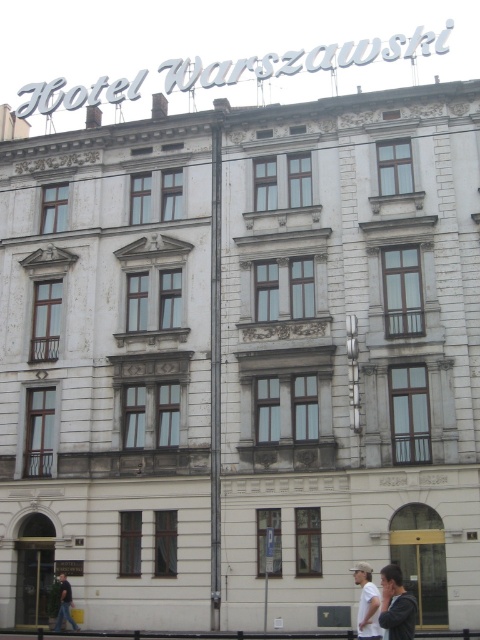
Who is shorter, dark gray hoodie at center or white cotton shirt at lower right?

With less height is dark gray hoodie at center.

Which is more to the left, dark gray hoodie at center or white cotton shirt at lower right?

white cotton shirt at lower right is more to the left.

Is point (388, 632) positioned after point (369, 564)?

No, it is in front of (369, 564).

At what (x,y) coordinates should I click in order to perform the action: click on dark gray hoodie at center. Please return your answer as a coordinate pair (x, y). The height and width of the screenshot is (640, 480). Looking at the image, I should click on (396, 604).

Consider the image. Does dark gray hoodie at center appear on the left side of dark gray cotton shirt at lower left?

Incorrect, dark gray hoodie at center is not on the left side of dark gray cotton shirt at lower left.

Can you confirm if dark gray hoodie at center is thinner than dark gray cotton shirt at lower left?

Incorrect, dark gray hoodie at center's width is not less than dark gray cotton shirt at lower left's.

What are the coordinates of `dark gray hoodie at center` in the screenshot? It's located at (396, 604).

Which is more to the right, white cotton shirt at lower right or dark gray cotton shirt at lower left?

Positioned to the right is white cotton shirt at lower right.

Who is more forward, (363,621) or (60,588)?

Point (363,621) is more forward.

Locate an element on the screen. The image size is (480, 640). white cotton shirt at lower right is located at coordinates (367, 602).